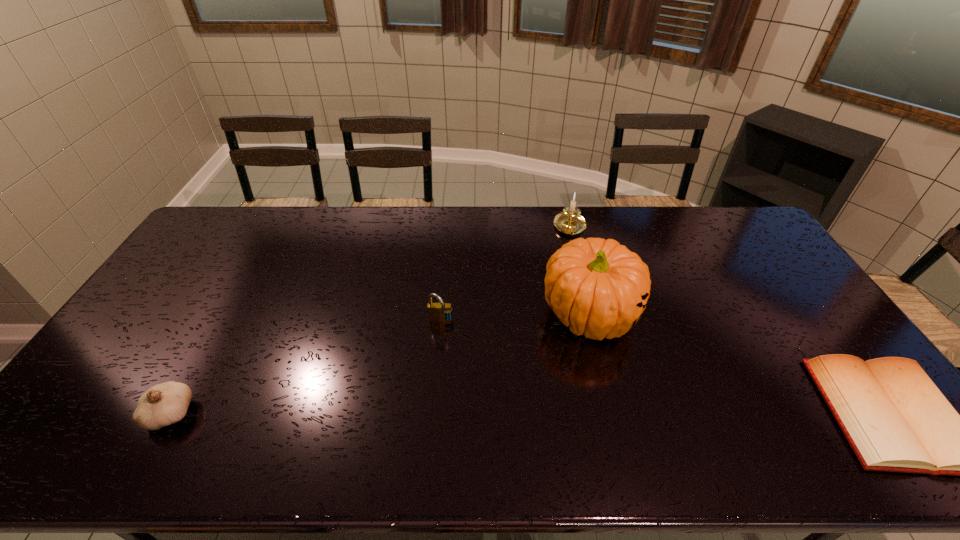
Image resolution: width=960 pixels, height=540 pixels. In order to click on free space on the desktop that is between the leftmost object and the Bible and is positioned on the handle side of the farthest object in this screenshot , I will do `click(586, 414)`.

I want to click on vacant space on the desktop that is between the garlic and the rightmost object and is positioned on the surface of the tallest object, so click(x=616, y=414).

Identify the location of free spot on the desktop that is between the leftmost object and the rightmost object and is positioned on the side with the combination dials of the second object from left to right. (431, 414).